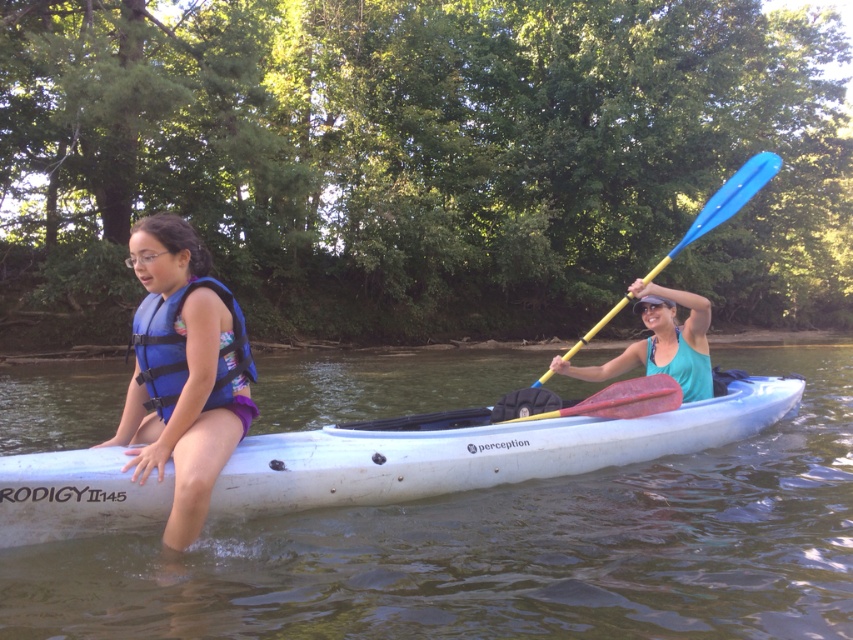
Who is shorter, blue life vest at left or blue plastic paddle at upper right?

Standing shorter between the two is blue life vest at left.

Is point (169, 294) farther from camera compared to point (753, 180)?

No, it is in front of (753, 180).

Describe the element at coordinates (183, 371) in the screenshot. I see `blue life vest at left` at that location.

What are the coordinates of `blue life vest at left` in the screenshot? It's located at (183, 371).

Is white plastic canoe at center above teal fabric kayak paddle at center?

Incorrect, white plastic canoe at center is not positioned above teal fabric kayak paddle at center.

Does white plastic canoe at center come behind teal fabric kayak paddle at center?

No, white plastic canoe at center is in front of teal fabric kayak paddle at center.

The height and width of the screenshot is (640, 853). What are the coordinates of `white plastic canoe at center` in the screenshot? It's located at (474, 451).

Can you confirm if teal fabric kayak paddle at center is positioned to the left of red rubber paddle at center?

In fact, teal fabric kayak paddle at center is to the right of red rubber paddle at center.

Is teal fabric kayak paddle at center thinner than red rubber paddle at center?

No, teal fabric kayak paddle at center is not thinner than red rubber paddle at center.

The height and width of the screenshot is (640, 853). What are the coordinates of `teal fabric kayak paddle at center` in the screenshot? It's located at [x=660, y=342].